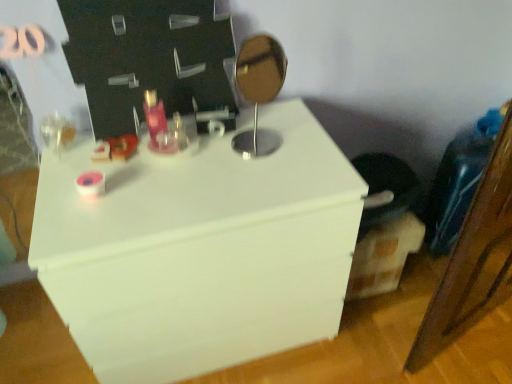
Question: Considering the positions of matte pink glass at center and white matte dresser at center in the image, is matte pink glass at center taller or shorter than white matte dresser at center?

Choices:
 (A) tall
 (B) short

Answer: (B)

Question: Considering the relative positions of matte pink glass at center and white matte dresser at center in the image provided, is matte pink glass at center to the left or to the right of white matte dresser at center?

Choices:
 (A) left
 (B) right

Answer: (A)

Question: Considering the real-world distances, which object is closest to the white matte dresser at center?

Choices:
 (A) matte pink glass at center
 (B) metallic silver mirror at center

Answer: (B)

Question: Which object is the closest to the matte pink glass at center?

Choices:
 (A) metallic silver mirror at center
 (B) white matte dresser at center

Answer: (A)